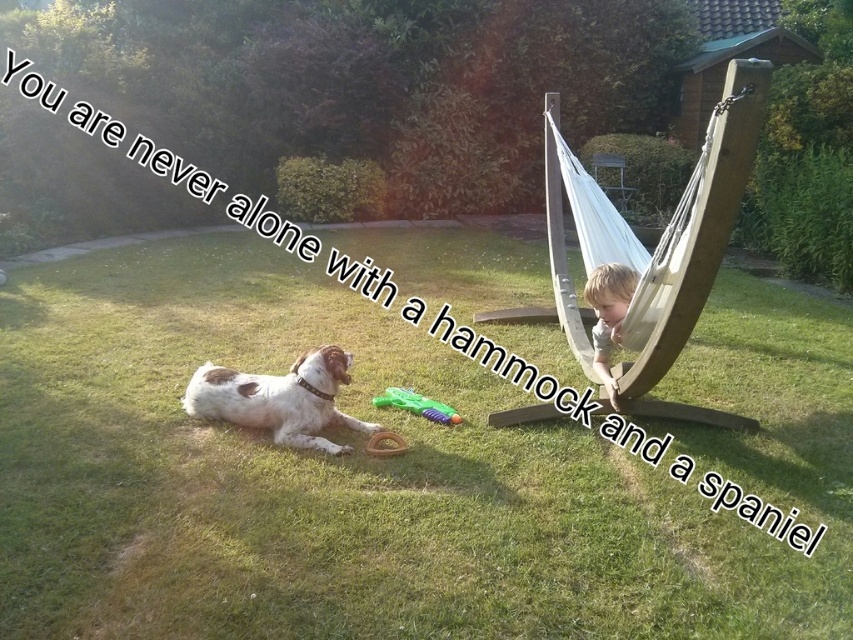
You are a photographer trying to capture the speckled fur dog at lower left and the green grass at lower left in a single shot. Since the camera can only focus on one subject at a time, which subject should you focus on to ensure the other remains in the background?

You should focus on the speckled fur dog at lower left because the green grass at lower left is positioned under it, so the dog will be in focus and the grass will naturally appear in the background.

You are a gardener who wants to plant a new flower bed in the backyard. You need to know which area has shorter vegetation to avoid blocking the view of the flower bed. According to the scene, which area should you choose between the green grass at lower left and the speckled fur dog at lower left?

The green grass at lower left has a lesser height compared to the speckled fur dog at lower left, so you should choose the green grass at lower left for planting the flower bed to avoid blocking the view.